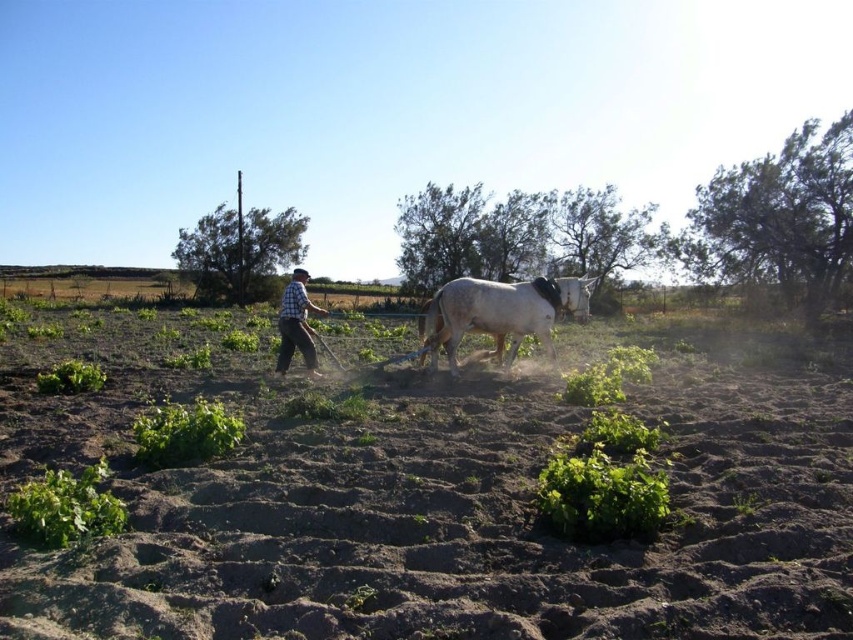
Can you confirm if white matte horse at center is positioned to the right of checkered fabric shirt at center?

Correct, you'll find white matte horse at center to the right of checkered fabric shirt at center.

Is point (440, 340) behind point (282, 369)?

Yes, it is behind point (282, 369).

Image resolution: width=853 pixels, height=640 pixels. What are the coordinates of `white matte horse at center` in the screenshot? It's located at (502, 310).

Is point (274, 584) behind point (299, 317)?

No, (274, 584) is closer to viewer.

Locate an element on the screen. brown soil at center is located at coordinates (x=433, y=509).

Is point (335, 554) less distant than point (496, 288)?

Yes, it is in front of point (496, 288).

Does brown soil at center appear on the left side of white matte horse at center?

Yes, brown soil at center is to the left of white matte horse at center.

Where is `brown soil at center`? The height and width of the screenshot is (640, 853). brown soil at center is located at coordinates (433, 509).